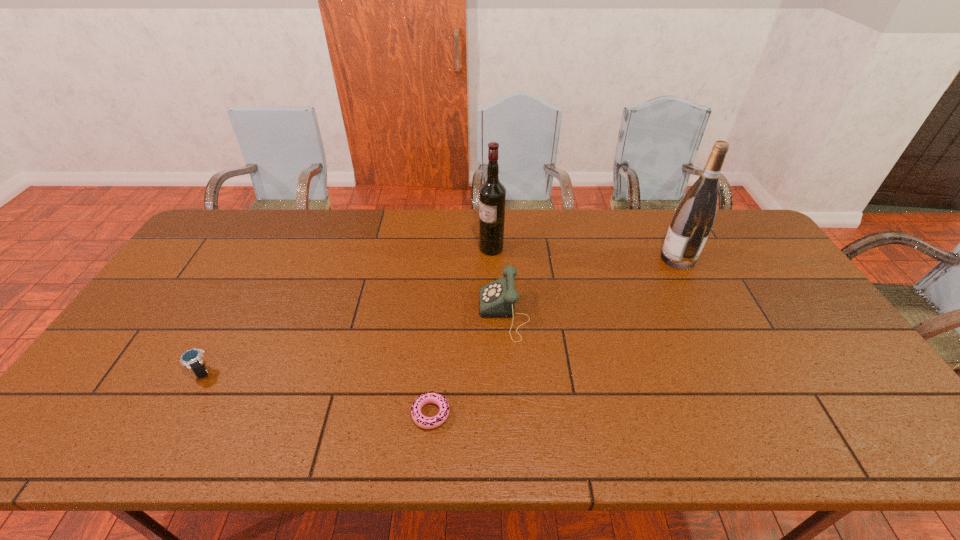
In the image, there is a desktop. Where is `blank space at the far edge`? The width and height of the screenshot is (960, 540). blank space at the far edge is located at coordinates (412, 222).

Identify the location of vacant space at the near edge of the desktop. This screenshot has height=540, width=960. (628, 452).

Locate an element on the screen. Image resolution: width=960 pixels, height=540 pixels. vacant space at the left edge of the desktop is located at coordinates (213, 259).

This screenshot has height=540, width=960. Find the location of `blank area at the right edge`. blank area at the right edge is located at coordinates (739, 252).

This screenshot has width=960, height=540. Find the location of `empty space that is in between the watch and the telephone`. empty space that is in between the watch and the telephone is located at coordinates (353, 343).

This screenshot has width=960, height=540. Find the location of `empty location between the right wine bottle and the third farthest object`. empty location between the right wine bottle and the third farthest object is located at coordinates (591, 286).

Locate an element on the screen. This screenshot has height=540, width=960. free point between the fourth object from right to left and the leftmost object is located at coordinates (316, 393).

In order to click on unoccupied position between the second nearest object and the right wine bottle in this screenshot , I will do `click(440, 315)`.

At what (x,y) coordinates should I click in order to perform the action: click on empty space that is in between the left wine bottle and the leftmost object. Please return your answer as a coordinate pair (x, y). The height and width of the screenshot is (540, 960). Looking at the image, I should click on (347, 310).

Locate an element on the screen. free area in between the left wine bottle and the second nearest object is located at coordinates (347, 310).